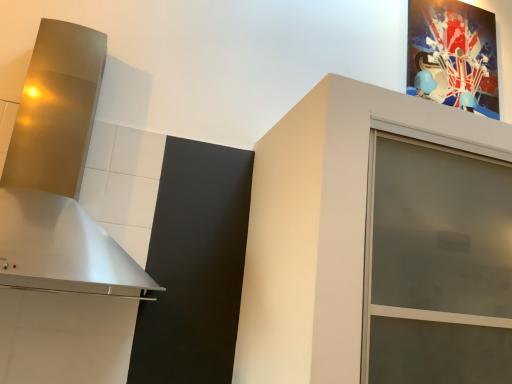
Question: From a real-world perspective, is metallic glossy picture frame at upper right under metallic silver vent at left?

Choices:
 (A) no
 (B) yes

Answer: (A)

Question: From a real-world perspective, is metallic glossy picture frame at upper right physically above metallic silver vent at left?

Choices:
 (A) yes
 (B) no

Answer: (A)

Question: Can you confirm if metallic glossy picture frame at upper right is wider than metallic silver vent at left?

Choices:
 (A) no
 (B) yes

Answer: (A)

Question: Can you confirm if metallic glossy picture frame at upper right is bigger than metallic silver vent at left?

Choices:
 (A) no
 (B) yes

Answer: (A)

Question: Is metallic glossy picture frame at upper right facing away from metallic silver vent at left?

Choices:
 (A) no
 (B) yes

Answer: (A)

Question: In terms of width, does frosted glass cabinet at upper right look wider or thinner when compared to metallic glossy picture frame at upper right?

Choices:
 (A) thin
 (B) wide

Answer: (B)

Question: Based on their positions, is frosted glass cabinet at upper right located to the left or right of metallic glossy picture frame at upper right?

Choices:
 (A) left
 (B) right

Answer: (A)

Question: In the image, is frosted glass cabinet at upper right positioned in front of or behind metallic glossy picture frame at upper right?

Choices:
 (A) behind
 (B) front

Answer: (B)

Question: Which is correct: frosted glass cabinet at upper right is inside metallic glossy picture frame at upper right, or outside of it?

Choices:
 (A) outside
 (B) inside

Answer: (A)

Question: Based on their positions, is metallic silver vent at left located to the left or right of frosted glass cabinet at upper right?

Choices:
 (A) right
 (B) left

Answer: (B)

Question: Considering the positions of metallic silver vent at left and frosted glass cabinet at upper right in the image, is metallic silver vent at left taller or shorter than frosted glass cabinet at upper right?

Choices:
 (A) tall
 (B) short

Answer: (A)

Question: Is metallic silver vent at left in front of or behind frosted glass cabinet at upper right in the image?

Choices:
 (A) front
 (B) behind

Answer: (A)

Question: From the image's perspective, is metallic silver vent at left positioned above or below frosted glass cabinet at upper right?

Choices:
 (A) below
 (B) above

Answer: (B)

Question: Is frosted glass cabinet at upper right wider or thinner than metallic silver vent at left?

Choices:
 (A) thin
 (B) wide

Answer: (B)

Question: From a real-world perspective, is frosted glass cabinet at upper right above or below metallic silver vent at left?

Choices:
 (A) above
 (B) below

Answer: (B)